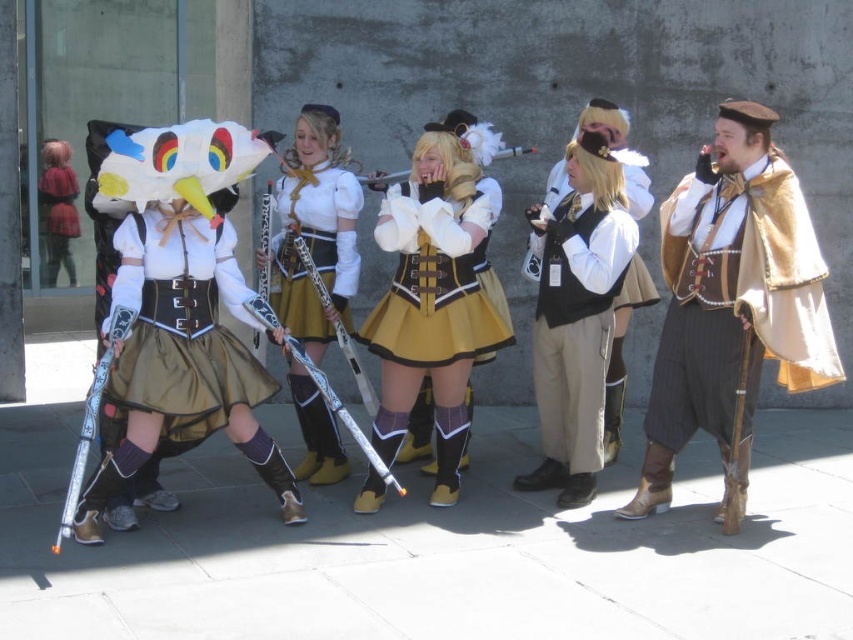
You are a photographer trying to capture a group photo of the matte white skirt at center and the plaid fabric shirt at left. Since you want to ensure both are fully visible in the frame, which object requires a wider angle to accommodate its size?

The matte white skirt at center requires a wider angle because its width is larger than the plaid fabric shirt at left.

You are a photographer at the cosplay event and need to capture both the matte brown cape at right and the black velvet vest at center in a single frame. Given that your camera has a fixed focal length, which costume element should you position closer to the camera to ensure both are in focus without adjusting the focus distance?

Since the matte brown cape at right is bigger than the black velvet vest at center, you should position the black velvet vest at center closer to the camera. This way, the larger cape will appear smaller in the frame, balancing their sizes, and maintaining focus on both without needing to adjust the focus distance.

Looking at this image, you are a photographer holding a camera. You want to take a photo of the matte brown cape at right. Can you fit the entire cape into your camera frame without moving? The camera has a 35mm lens, which can capture a width of 2 meters at a distance of 5 meters.

The matte brown cape at right and camera are 5.22 meters apart. Since the camera can capture a width of 2 meters at 5 meters, and the distance is slightly more than 5 meters, the camera might not capture the entire cape unless it is smaller than 2 meters in width.